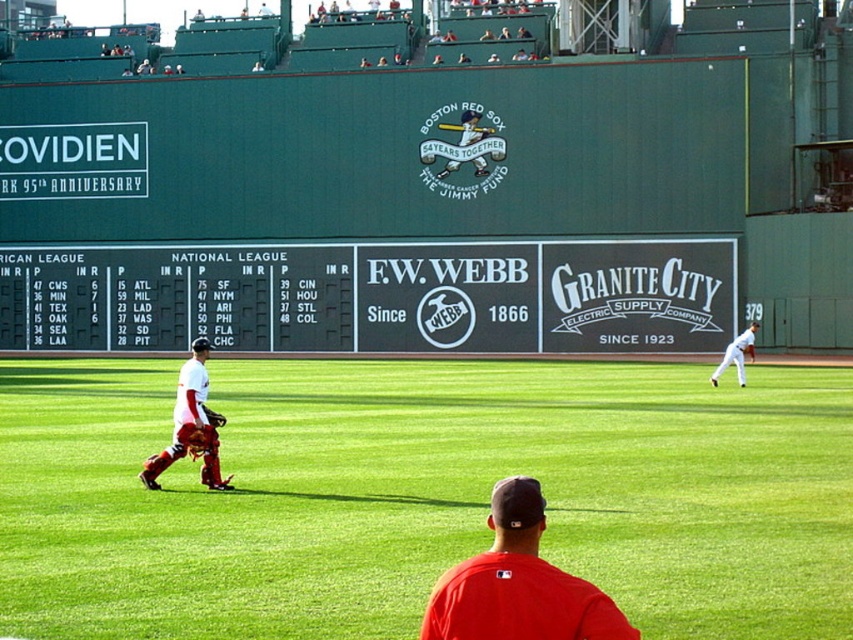
Question: Which object is the closest to the brown leather glove at center?

Choices:
 (A) brown leather glove at left
 (B) green grass at center

Answer: (A)

Question: Considering the real-world distances, which object is farthest from the red matte baseball cap at center?

Choices:
 (A) brown leather glove at left
 (B) black matte scoreboard at center
 (C) brown leather glove at center

Answer: (B)

Question: Does red matte baseball cap at center have a larger size compared to white matte baseball player at right?

Choices:
 (A) yes
 (B) no

Answer: (B)

Question: From the image, what is the correct spatial relationship of matte red catcher at left in relation to brown leather glove at center?

Choices:
 (A) right
 (B) left

Answer: (B)

Question: Which of the following is the closest to the observer?

Choices:
 (A) (189, 392)
 (B) (216, 412)

Answer: (A)

Question: Observing the image, what is the correct spatial positioning of red matte baseball cap at center in reference to white matte baseball player at right?

Choices:
 (A) above
 (B) below

Answer: (B)